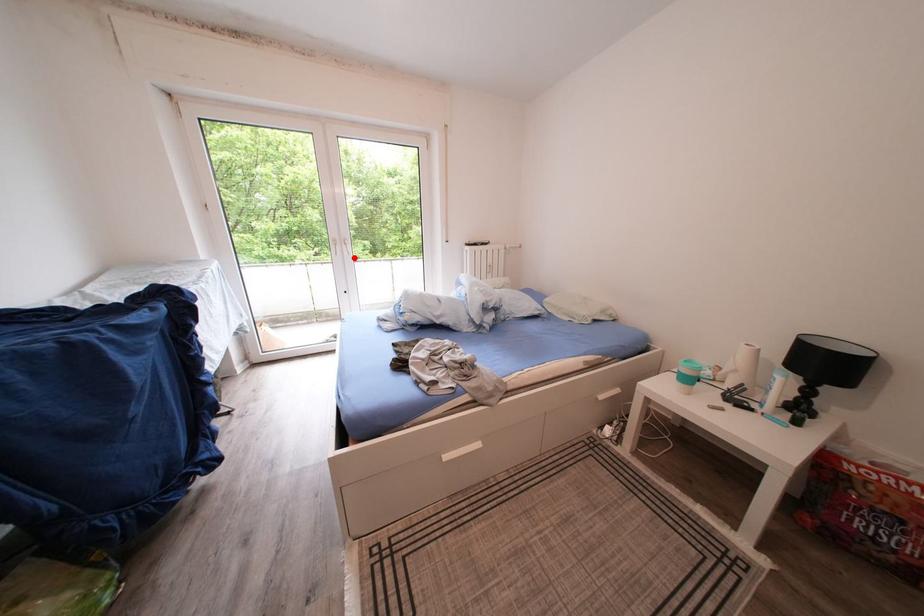
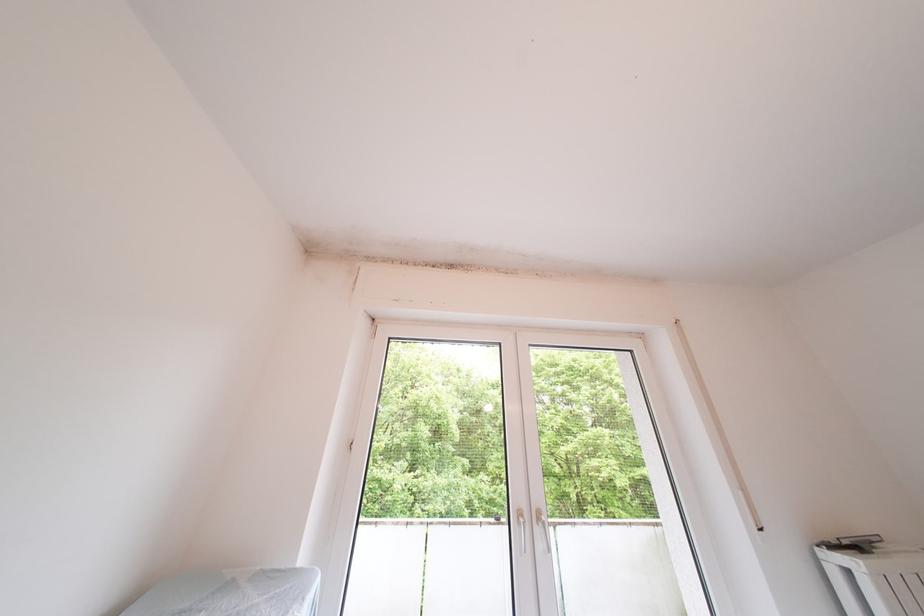
In the second image, find the point that corresponds to the highlighted location in the first image.

(550, 552)